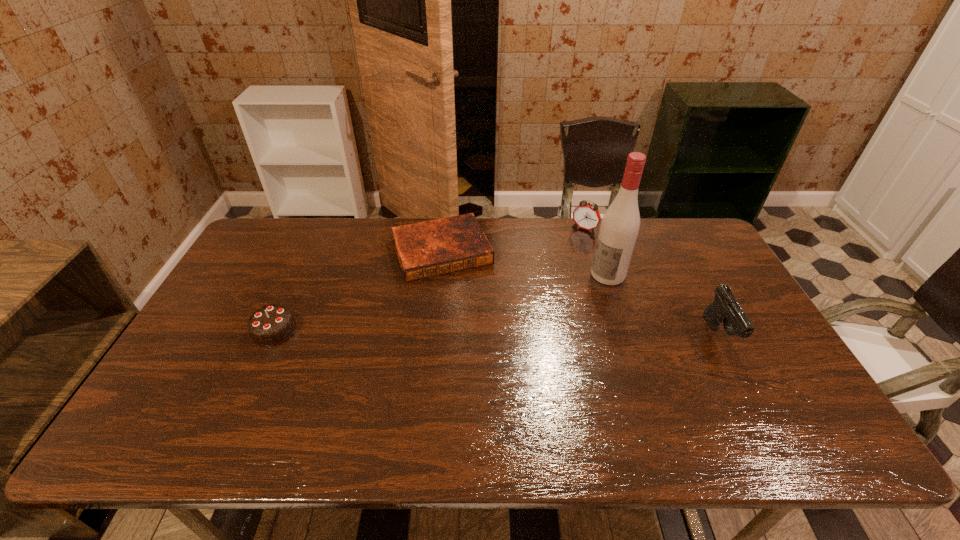
You are a GUI agent. You are given a task and a screenshot of the screen. Output one action in this format:
    pyautogui.click(x=<x>, y=<y>)
    Task: Click on the free space on the desktop that is between the leftmost object and the pistol and is positioned on the label of the alcohol
    
    Given the screenshot: What is the action you would take?
    pyautogui.click(x=528, y=333)

The width and height of the screenshot is (960, 540). In order to click on free spot on the desktop that is between the chocolate cake and the rightmost object and is positioned on the spine side of the second object from left to right in this screenshot , I will do `click(475, 333)`.

At what (x,y) coordinates should I click in order to perform the action: click on free spot on the desktop that is between the leftmost object and the rightmost object and is positioned on the clock face of the alarm clock. Please return your answer as a coordinate pair (x, y). The height and width of the screenshot is (540, 960). Looking at the image, I should click on (510, 333).